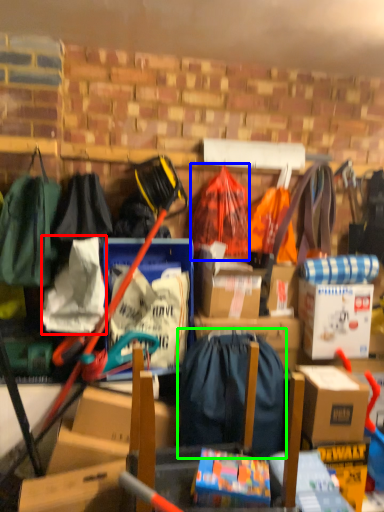
Question: Which object is the closest to the clothing (highlighted by a red box)? Choose among these: clothing (highlighted by a blue box) or backpack (highlighted by a green box).

Choices:
 (A) clothing
 (B) backpack

Answer: (B)